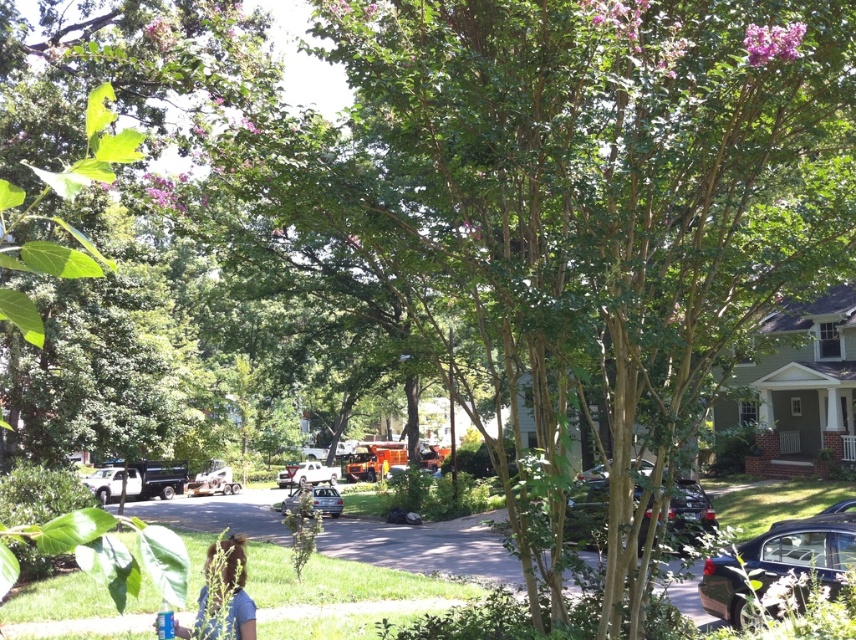
Question: Which object is closer to the camera taking this photo?

Choices:
 (A) white matte car at center
 (B) shiny dark blue sedan at lower right
 (C) metallic silver sedan at center

Answer: (B)

Question: Which of these objects is positioned closest to the shiny dark blue sedan at lower right?

Choices:
 (A) white matte car at center
 (B) shiny black sedan at center
 (C) metallic silver truck at center
 (D) metallic silver sedan at center

Answer: (B)

Question: Does shiny dark blue sedan at lower right have a greater width compared to metallic silver truck at center?

Choices:
 (A) yes
 (B) no

Answer: (B)

Question: Can you confirm if shiny dark blue sedan at lower right is positioned below white matte car at center?

Choices:
 (A) no
 (B) yes

Answer: (A)

Question: Does shiny black sedan at center appear under metallic silver truck at center?

Choices:
 (A) yes
 (B) no

Answer: (B)

Question: Which is nearer to the shiny black sedan at center?

Choices:
 (A) shiny dark blue sedan at lower right
 (B) metallic silver truck at center
 (C) white matte car at center
 (D) metallic silver sedan at center

Answer: (A)